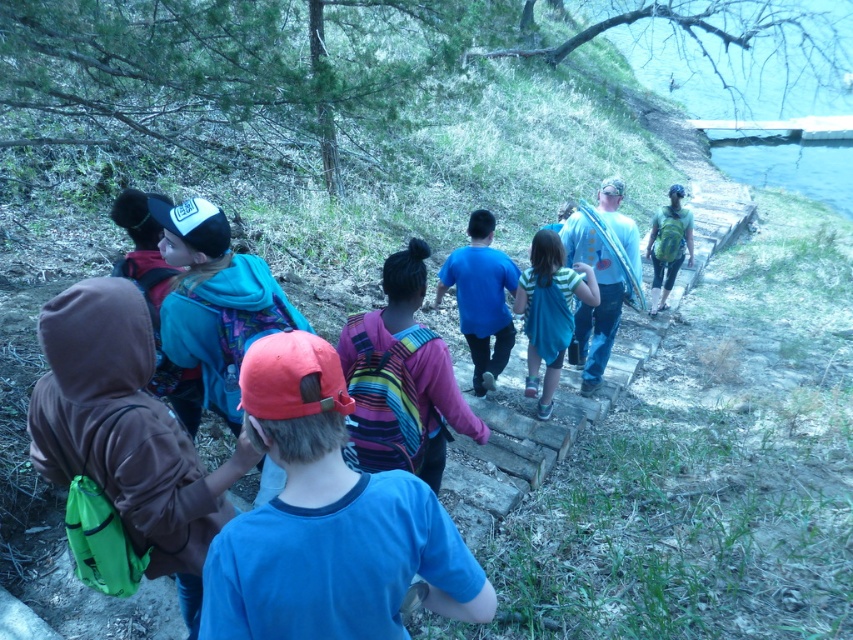
Can you confirm if striped fabric backpack at center is thinner than green fabric backpack at right?

Yes, striped fabric backpack at center is thinner than green fabric backpack at right.

Does striped fabric backpack at center come behind green fabric backpack at right?

No, it is not.

Who is more forward, (x=532, y=280) or (x=660, y=278)?

Point (x=532, y=280) is in front.

Image resolution: width=853 pixels, height=640 pixels. I want to click on striped fabric backpack at center, so click(x=549, y=310).

Between blue t-shirt at center and striped backpack at center, which one appears on the left side from the viewer's perspective?

blue t-shirt at center is more to the left.

Does blue t-shirt at center have a smaller size compared to striped backpack at center?

Yes, blue t-shirt at center is smaller than striped backpack at center.

Where is `blue t-shirt at center`? blue t-shirt at center is located at coordinates (328, 520).

Is point (509, 342) positioned before point (567, 269)?

That is False.

Does blue cotton shirt at center appear on the left side of striped fabric backpack at center?

Correct, you'll find blue cotton shirt at center to the left of striped fabric backpack at center.

Locate an element on the screen. Image resolution: width=853 pixels, height=640 pixels. blue cotton shirt at center is located at coordinates (480, 298).

At what (x,y) coordinates should I click in order to perform the action: click on blue cotton shirt at center. Please return your answer as a coordinate pair (x, y). Looking at the image, I should click on (480, 298).